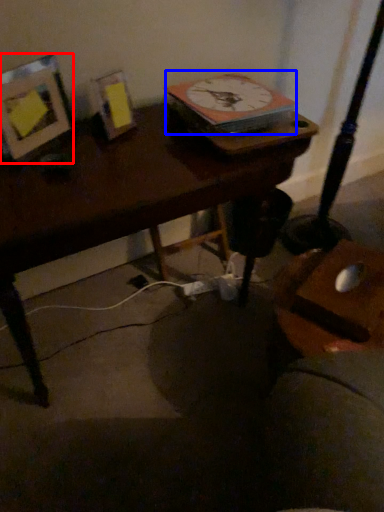
Question: Which point is further to the camera, picture frame (highlighted by a red box) or clock (highlighted by a blue box)?

Choices:
 (A) picture frame
 (B) clock

Answer: (B)